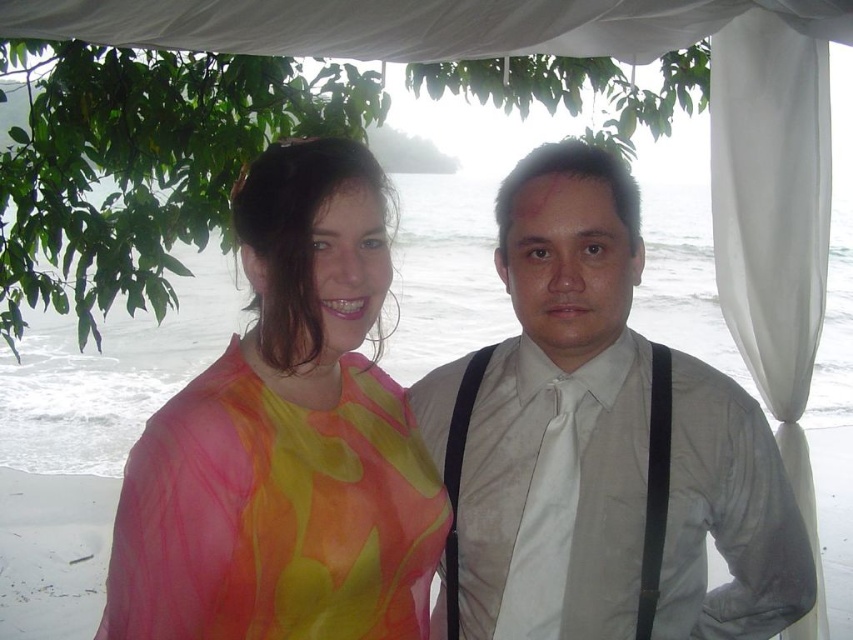
Question: Which of the following is the closest to the observer?

Choices:
 (A) green leafy tree at upper left
 (B) translucent floral blouse at center
 (C) white sheer curtain at right

Answer: (B)

Question: Among these points, which one is farthest from the camera?

Choices:
 (A) (175, 74)
 (B) (444, 493)
 (C) (730, 212)
 (D) (465, 400)

Answer: (A)

Question: Can you confirm if white satin shirt at center is positioned above translucent floral blouse at center?

Choices:
 (A) no
 (B) yes

Answer: (A)

Question: Which of the following is the closest to the observer?

Choices:
 (A) translucent floral blouse at center
 (B) white satin shirt at center
 (C) white sheer curtain at right
 (D) green leafy tree at upper left

Answer: (A)

Question: Is white sheer curtain at right positioned in front of white satin tie at center?

Choices:
 (A) no
 (B) yes

Answer: (A)

Question: Can you confirm if white satin shirt at center is positioned to the right of white sheer curtain at right?

Choices:
 (A) no
 (B) yes

Answer: (A)